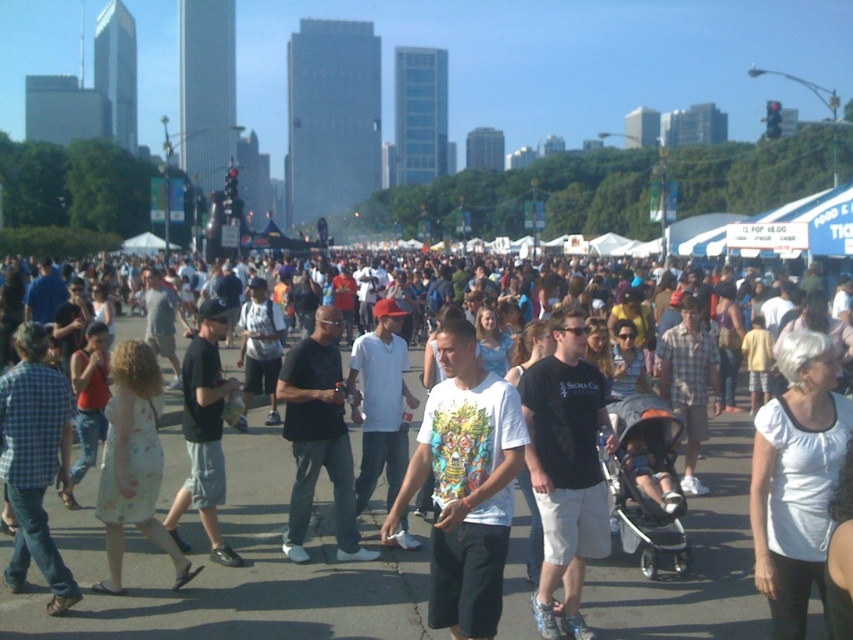
Question: Can you confirm if white cotton crowd at center is bigger than black matte shirt at center?

Choices:
 (A) yes
 (B) no

Answer: (A)

Question: Is white cotton crowd at center below black matte shirt at center?

Choices:
 (A) no
 (B) yes

Answer: (B)

Question: Which object is the farthest from the white cotton crowd at center?

Choices:
 (A) white matte t-shirt at center
 (B) black matte shirt at center

Answer: (A)

Question: Which of the following is the closest to the observer?

Choices:
 (A) white matte t-shirt at center
 (B) black matte shirt at center

Answer: (A)

Question: Which object is closer to the camera taking this photo?

Choices:
 (A) white matte t-shirt at center
 (B) white cotton crowd at center
 (C) black matte shirt at center

Answer: (A)

Question: Is white cotton crowd at center below black matte shirt at center?

Choices:
 (A) yes
 (B) no

Answer: (A)